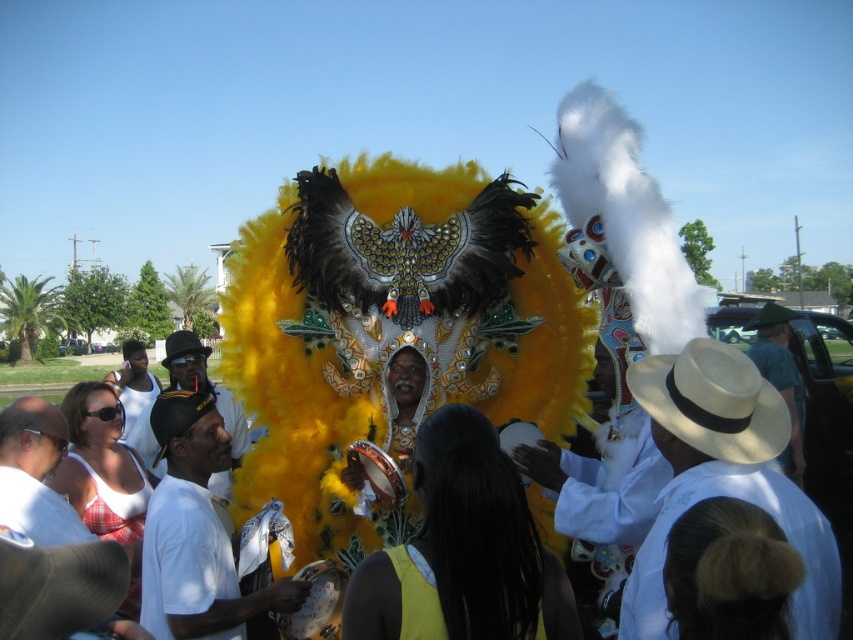
You are organizing a photo shoot and need to arrange props in the background. The light brown straw hat at lower right and the white cotton shirt at lower left are placed in the scene. Which prop takes up more space in the background?

The white cotton shirt at lower left takes up more space in the background than the light brown straw hat at lower right because the light brown straw hat at lower right occupies less space than the white cotton shirt at lower left.

You are a photographer at the event and want to capture a photo of the brown straw cowboy hat at center without the white cotton shirt at lower left appearing in the foreground. Is this possible based on their positions?

The white cotton shirt at lower left is positioned under the brown straw cowboy hat at center, so the shirt is below the hat. Since the shirt is under the hat, it would be in the foreground if the hat is above it. Therefore, it might be challenging to capture the hat without the shirt appearing in the foreground unless you adjust your angle or position to frame the hat above the shirt.

You are organizing a costume party and need to decide which item takes up more space when placed side by side. Based on the image, which item is larger between the white cotton shirt at lower left and the brown straw cowboy hat at center?

The brown straw cowboy hat at center occupies more space than the white cotton shirt at lower left according to the description.